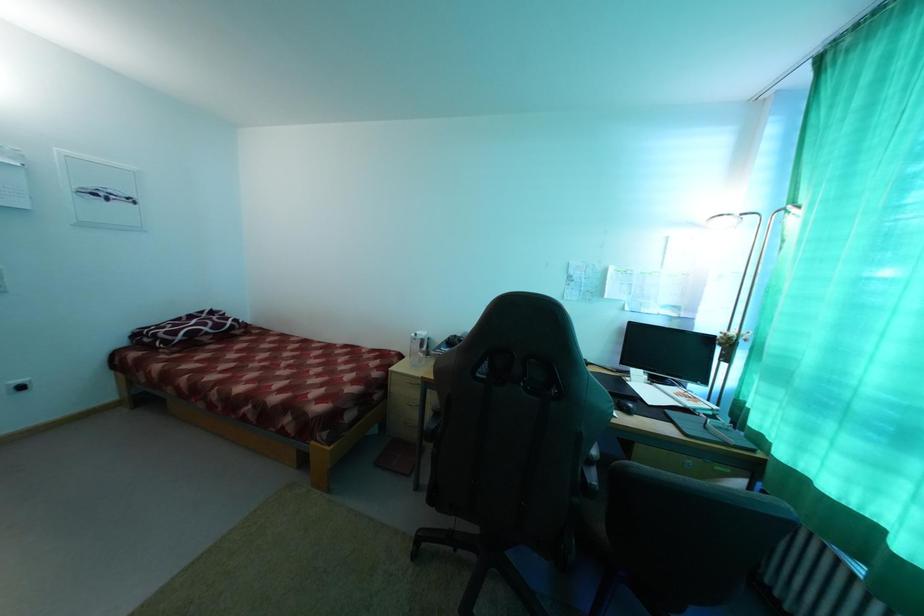
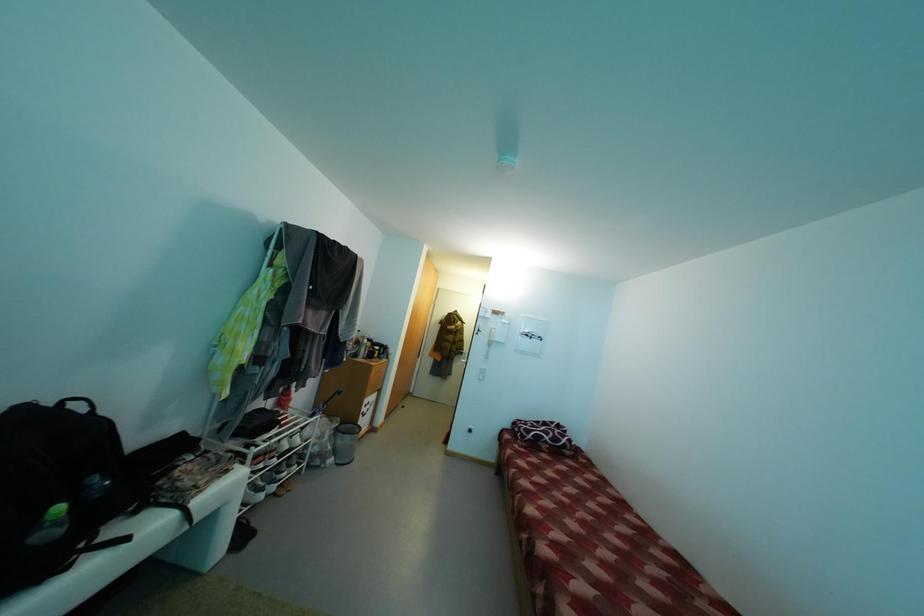
Question: The images are taken continuously from a first-person perspective. In which direction is your viewpoint rotating?

Choices:
 (A) Left
 (B) Right
 (C) Up
 (D) Down

Answer: (A)